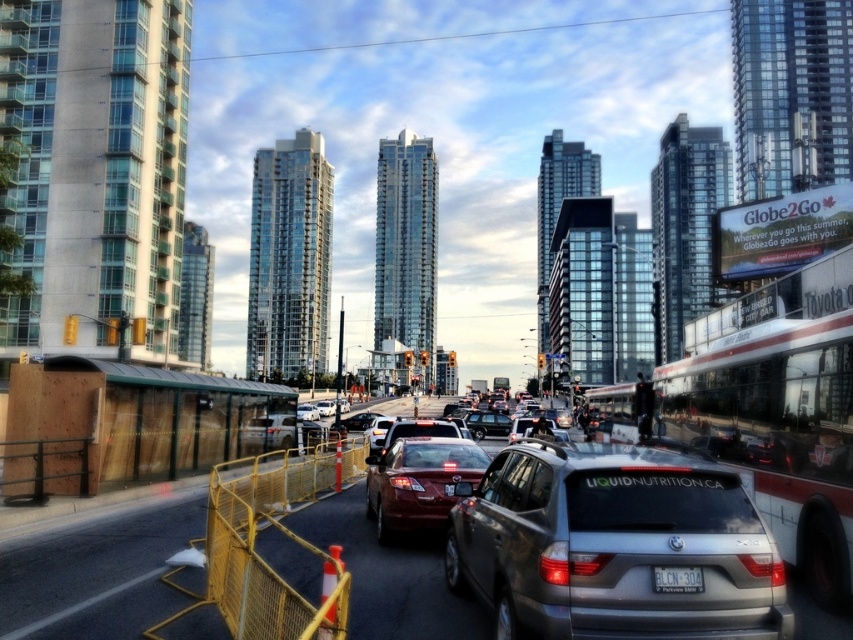
Between point (666, 564) and point (378, 502), which one is positioned behind?

The point (378, 502) is behind.

Is satin silver suv at center shorter than shiny red sedan at center?

Incorrect, satin silver suv at center's height does not fall short of shiny red sedan at center's.

Identify the location of satin silver suv at center. The image size is (853, 640). (613, 545).

Is point (666, 586) closer to viewer compared to point (503, 417)?

Yes.

Who is positioned more to the right, white plastic license plate at center or shiny black sedan at center?

shiny black sedan at center

Is point (677, 579) less distant than point (503, 417)?

Yes, it is.

Find the location of a particular element. white plastic license plate at center is located at coordinates pos(677,579).

Can you confirm if satin silver suv at center is bigger than shiny black sedan at center?

No.

Image resolution: width=853 pixels, height=640 pixels. What do you see at coordinates (613, 545) in the screenshot?
I see `satin silver suv at center` at bounding box center [613, 545].

Who is more distant from viewer, (x=581, y=614) or (x=494, y=429)?

Positioned behind is point (x=494, y=429).

Identify the location of satin silver suv at center. The height and width of the screenshot is (640, 853). (613, 545).